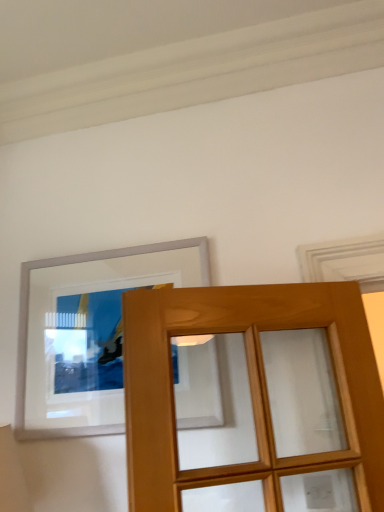
Question: Should I look upward or downward to see white glossy picture frame at upper left?

Choices:
 (A) up
 (B) down

Answer: (B)

Question: Considering the relative positions of light brown wood door at center and white glossy picture frame at upper left in the image provided, is light brown wood door at center to the right of white glossy picture frame at upper left from the viewer's perspective?

Choices:
 (A) yes
 (B) no

Answer: (A)

Question: Is light brown wood door at center looking in the opposite direction of white glossy picture frame at upper left?

Choices:
 (A) yes
 (B) no

Answer: (A)

Question: Is white glossy picture frame at upper left located within light brown wood door at center?

Choices:
 (A) no
 (B) yes

Answer: (A)

Question: Is the depth of light brown wood door at center greater than that of white glossy picture frame at upper left?

Choices:
 (A) yes
 (B) no

Answer: (B)

Question: Is light brown wood door at center next to white glossy picture frame at upper left and touching it?

Choices:
 (A) no
 (B) yes

Answer: (A)

Question: Is light brown wood door at center shorter than white glossy picture frame at upper left?

Choices:
 (A) no
 (B) yes

Answer: (A)

Question: From a real-world perspective, is white glossy picture frame at upper left under light brown wood door at center?

Choices:
 (A) no
 (B) yes

Answer: (A)

Question: Does white glossy picture frame at upper left have a lesser width compared to light brown wood door at center?

Choices:
 (A) yes
 (B) no

Answer: (A)

Question: Is white glossy picture frame at upper left not near light brown wood door at center?

Choices:
 (A) no
 (B) yes

Answer: (A)

Question: From a real-world perspective, is white glossy picture frame at upper left physically above light brown wood door at center?

Choices:
 (A) yes
 (B) no

Answer: (A)

Question: From the image's perspective, is white glossy picture frame at upper left above light brown wood door at center?

Choices:
 (A) no
 (B) yes

Answer: (B)

Question: Does white glossy picture frame at upper left have a lesser height compared to light brown wood door at center?

Choices:
 (A) no
 (B) yes

Answer: (B)

Question: From their relative heights in the image, would you say white glossy picture frame at upper left is taller or shorter than light brown wood door at center?

Choices:
 (A) tall
 (B) short

Answer: (B)